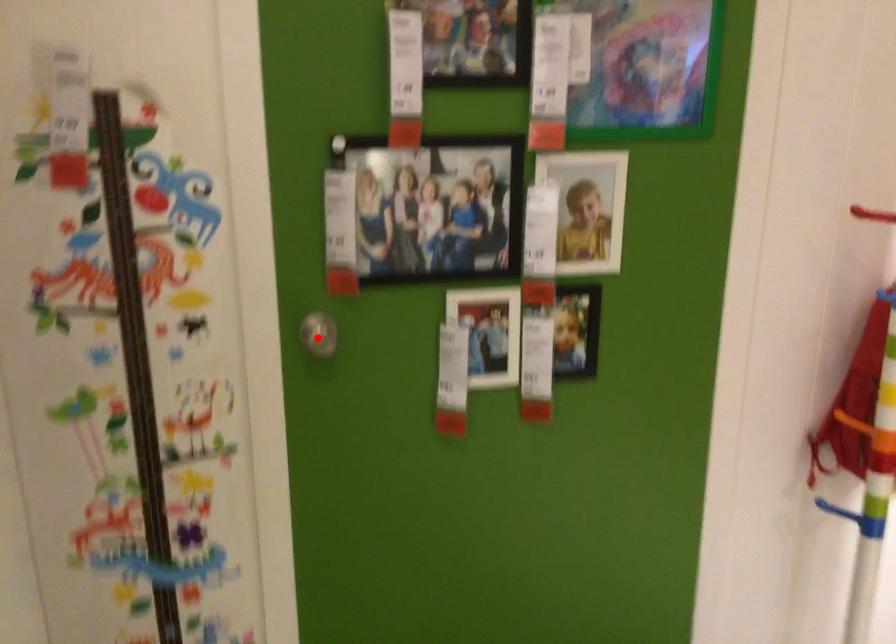
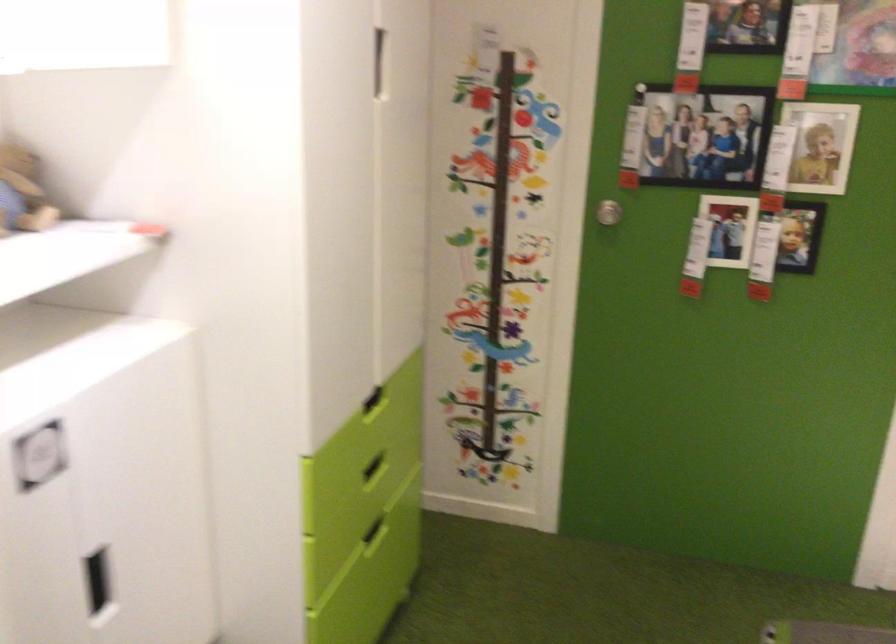
Question: A red point is marked in image1. In image2, is the corresponding 3D point closer to the camera or farther? Reply with the corresponding letter.

Choices:
 (A) The corresponding 3D point is closer.
 (B) The corresponding 3D point is farther.

Answer: (B)